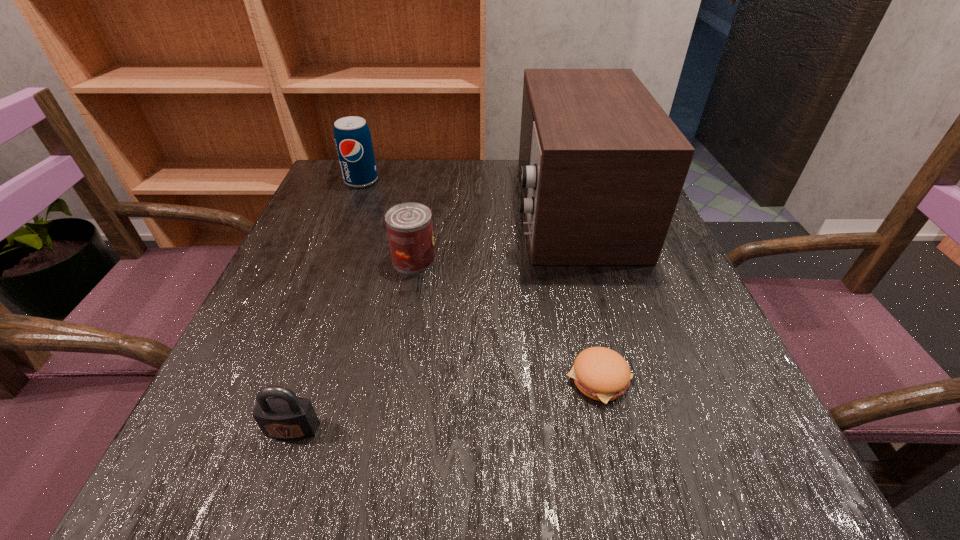
At what (x,y) coordinates should I click in order to perform the action: click on the tallest object. Please return your answer as a coordinate pair (x, y). Looking at the image, I should click on (602, 166).

Locate an element on the screen. This screenshot has height=540, width=960. pop is located at coordinates (352, 136).

This screenshot has width=960, height=540. I want to click on the third object from left to right, so click(x=409, y=226).

The image size is (960, 540). Find the location of `the nearest object`. the nearest object is located at coordinates tap(284, 416).

Image resolution: width=960 pixels, height=540 pixels. What are the coordinates of `the shortest object` in the screenshot? It's located at [600, 373].

The image size is (960, 540). I want to click on patty, so click(x=600, y=373).

At what (x,y) coordinates should I click in order to perform the action: click on free spot located on the front-facing side of the tallest object. Please return your answer as a coordinate pair (x, y). Looking at the image, I should click on (350, 208).

The image size is (960, 540). Identify the location of free spot located on the front-facing side of the tallest object. (386, 208).

Locate an element on the screen. The width and height of the screenshot is (960, 540). blank space located 0.330m on the front-facing side of the tallest object is located at coordinates (369, 208).

Locate an element on the screen. The width and height of the screenshot is (960, 540). free space located on the front of the fourth shortest object is located at coordinates (311, 308).